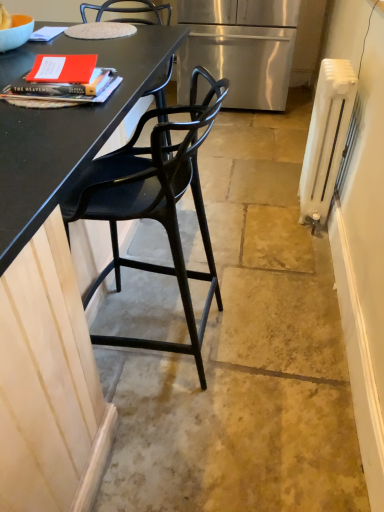
Question: Can you confirm if black matte chair at left is bigger than white painted metal radiator at right?

Choices:
 (A) no
 (B) yes

Answer: (B)

Question: Can you see black matte chair at left touching white painted metal radiator at right?

Choices:
 (A) yes
 (B) no

Answer: (B)

Question: Can you confirm if black matte chair at left is smaller than white painted metal radiator at right?

Choices:
 (A) no
 (B) yes

Answer: (A)

Question: From the image's perspective, is black matte chair at left below white painted metal radiator at right?

Choices:
 (A) yes
 (B) no

Answer: (A)

Question: Is black matte chair at left in front of white painted metal radiator at right?

Choices:
 (A) yes
 (B) no

Answer: (A)

Question: Is black matte chair at left looking in the opposite direction of white painted metal radiator at right?

Choices:
 (A) no
 (B) yes

Answer: (A)

Question: Is stainless steel refrigerator at center taller than white painted metal radiator at right?

Choices:
 (A) no
 (B) yes

Answer: (B)

Question: Is stainless steel refrigerator at center far from white painted metal radiator at right?

Choices:
 (A) no
 (B) yes

Answer: (B)

Question: Is stainless steel refrigerator at center at the right side of white painted metal radiator at right?

Choices:
 (A) no
 (B) yes

Answer: (A)

Question: Considering the relative sizes of stainless steel refrigerator at center and white painted metal radiator at right in the image provided, is stainless steel refrigerator at center shorter than white painted metal radiator at right?

Choices:
 (A) no
 (B) yes

Answer: (A)

Question: From a real-world perspective, is stainless steel refrigerator at center beneath white painted metal radiator at right?

Choices:
 (A) no
 (B) yes

Answer: (A)

Question: Can you confirm if stainless steel refrigerator at center is bigger than white painted metal radiator at right?

Choices:
 (A) no
 (B) yes

Answer: (B)

Question: Would you say white painted metal radiator at right is a long distance from black matte chair at left?

Choices:
 (A) no
 (B) yes

Answer: (A)